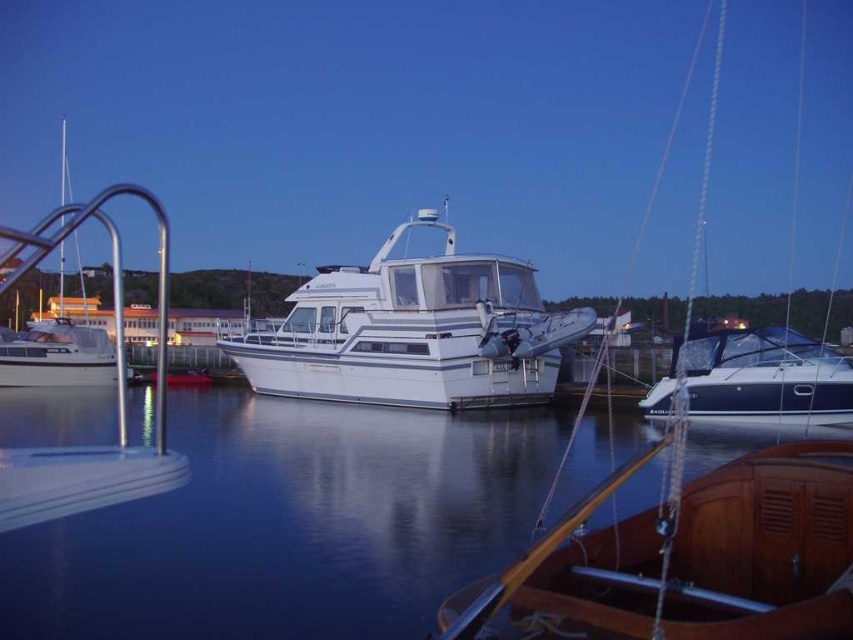
Who is more distant from viewer, (469, 394) or (102, 358)?

The point (102, 358) is behind.

Who is higher up, white glossy boat at center or white glossy boat at left?

white glossy boat at left is above.

Is point (316, 289) farther from viewer compared to point (86, 371)?

That is False.

Locate an element on the screen. The image size is (853, 640). white glossy boat at center is located at coordinates (415, 332).

Based on the photo, measure the distance between point (599,438) and camera.

52.38 feet

Is point (112, 534) more distant than point (467, 326)?

That is False.

Locate an element on the screen. smooth water at center is located at coordinates (289, 525).

Who is more distant from viewer, (312, 508) or (737, 378)?

Point (737, 378)

Can you confirm if smooth water at center is positioned to the right of blue glossy sailboat at right?

In fact, smooth water at center is to the left of blue glossy sailboat at right.

I want to click on smooth water at center, so click(x=289, y=525).

At what (x,y) coordinates should I click in order to perform the action: click on smooth water at center. Please return your answer as a coordinate pair (x, y). The height and width of the screenshot is (640, 853). Looking at the image, I should click on (289, 525).